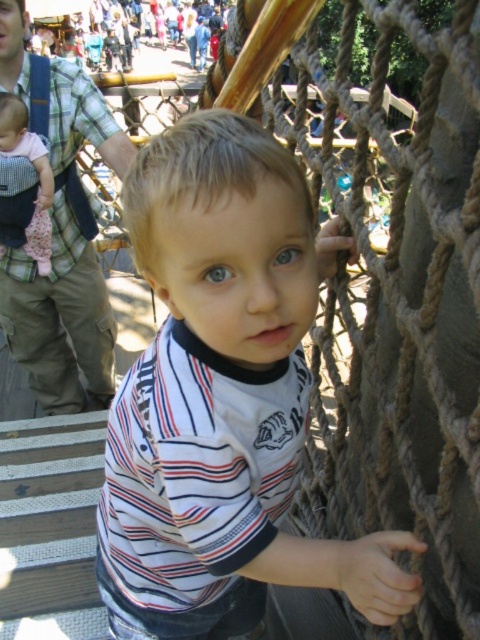
Who is positioned more to the left, white striped shirt at center or matte black baby carrier at left?

matte black baby carrier at left

Which is behind, point (163, 548) or point (27, 243)?

Positioned behind is point (27, 243).

Identify the location of white striped shirt at center. (223, 397).